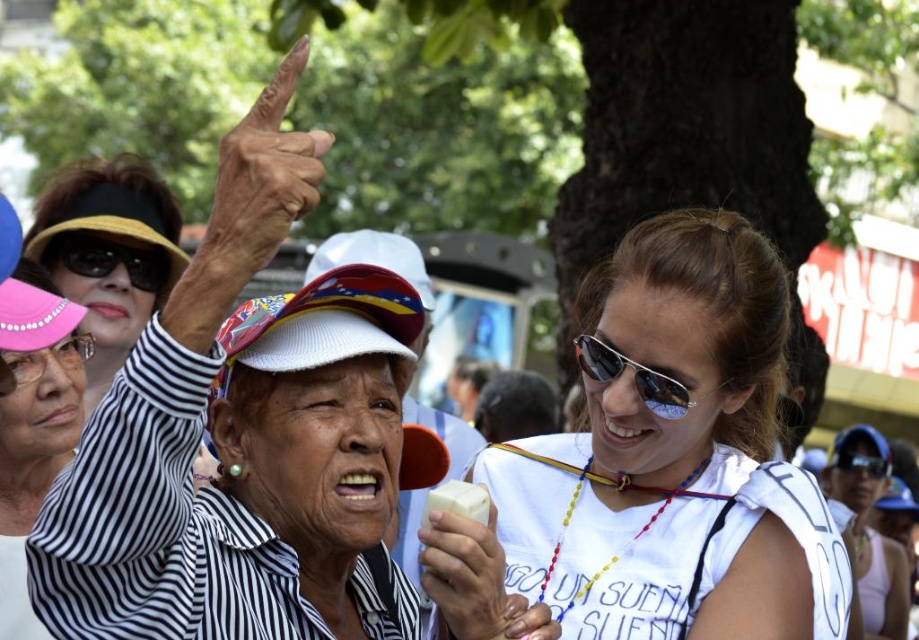
You are standing in the outdoor gathering scene and notice two items in the image. The first is the matte black visor at upper left and the second is the sunglasses at center. Which of these two items is positioned higher up in the image?

The matte black visor at upper left is much taller as sunglasses at center, so the matte black visor at upper left is positioned higher up in the image.

You are a photographer trying to capture a clear shot of the sunglasses at center without the matte black visor at upper left blocking it. Is there a way to adjust your angle to achieve this?

The matte black visor at upper left is positioned over the sunglasses at center, so adjusting your angle downward might allow you to capture the sunglasses at center without the visor blocking it.

You are a photographer trying to capture a closeup of the white glossy tank top at center and the white matte ice cream at lower center. Which object should you zoom in on to ensure it fills the frame without cropping?

The white glossy tank top at center is larger in size than the white matte ice cream at lower center, so you should zoom in on the white glossy tank top at center to ensure it fills the frame without cropping.